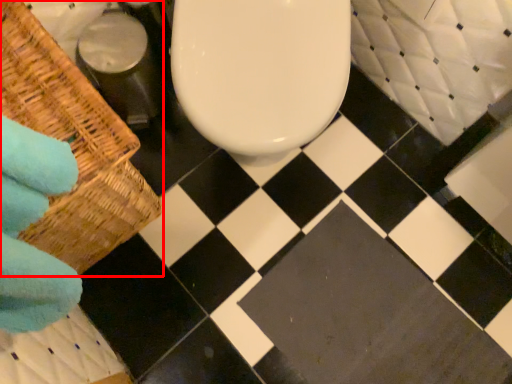
Question: Where is basket (annotated by the red box) located in relation to square in the image?

Choices:
 (A) right
 (B) left

Answer: (B)